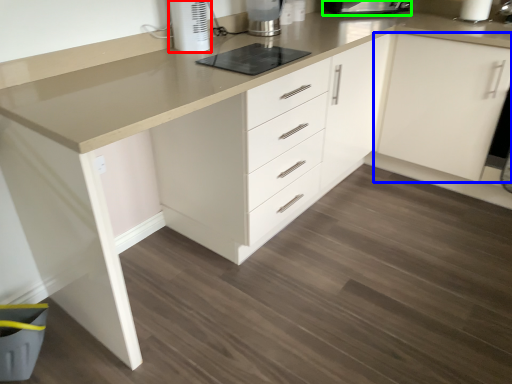
Question: Considering the real-world distances, which object is farthest from home appliance (highlighted by a red box)? cabinetry (highlighted by a blue box) or kitchen appliance (highlighted by a green box)?

Choices:
 (A) cabinetry
 (B) kitchen appliance

Answer: (A)